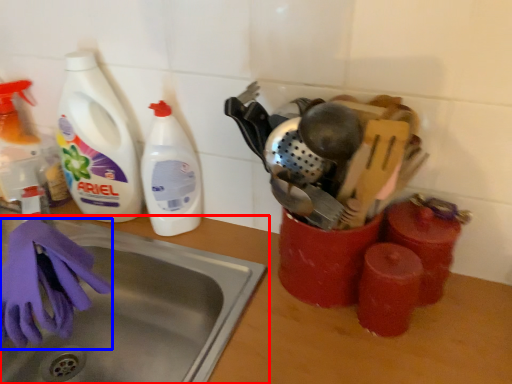
Question: Which object is further to the camera taking this photo, sink (highlighted by a red box) or glove (highlighted by a blue box)?

Choices:
 (A) sink
 (B) glove

Answer: (B)